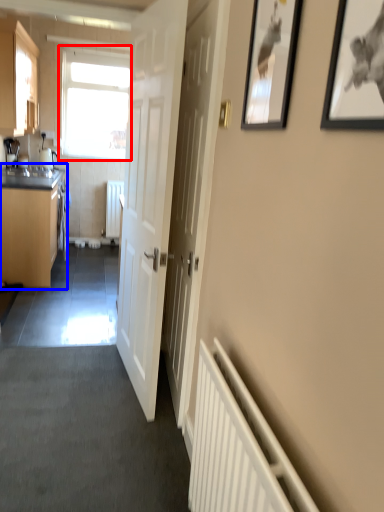
Question: Which object appears closest to the camera in this image, window (highlighted by a red box) or cabinetry (highlighted by a blue box)?

Choices:
 (A) window
 (B) cabinetry

Answer: (B)